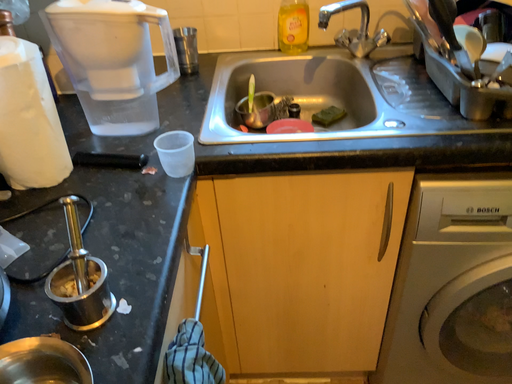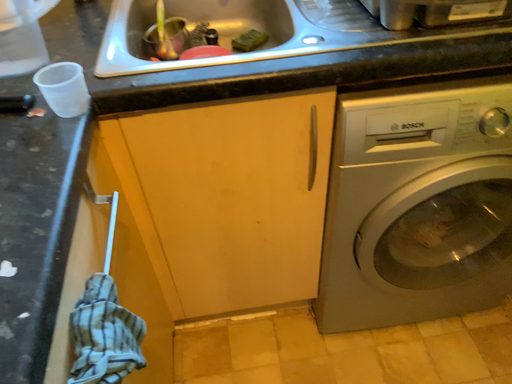
Question: Which way did the camera rotate in the video?

Choices:
 (A) rotated upward
 (B) rotated downward

Answer: (B)